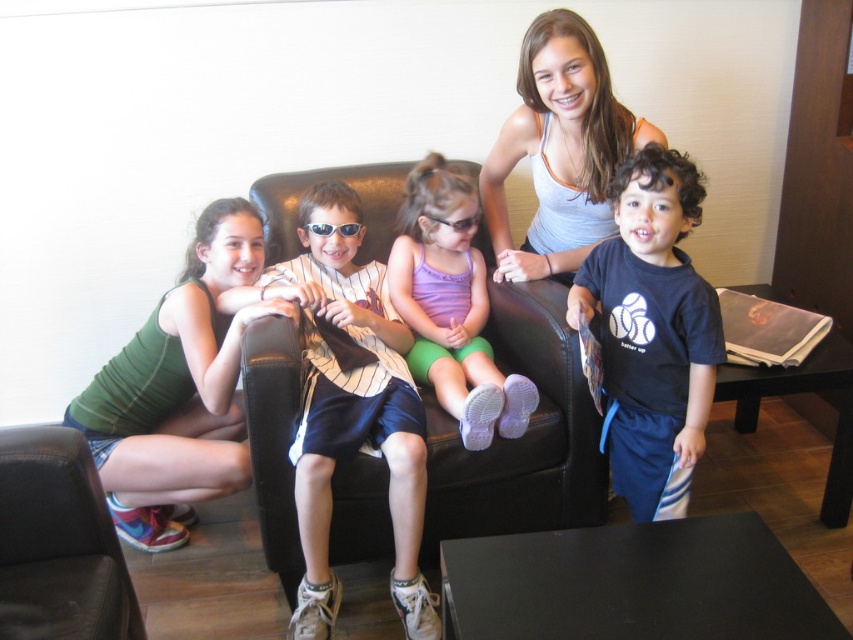
Question: Which object appears closest to the camera in this image?

Choices:
 (A) black plastic sunglasses at center
 (B) white tank top at upper center

Answer: (B)

Question: Is green fabric tank top at lower left positioned behind white tank top at upper center?

Choices:
 (A) yes
 (B) no

Answer: (B)

Question: From the image, what is the correct spatial relationship of white striped shirt at center in relation to purple fabric shorts at center?

Choices:
 (A) left
 (B) right

Answer: (A)

Question: Which object is closer to the camera taking this photo?

Choices:
 (A) black matte shirt at center
 (B) white tank top at upper center

Answer: (A)

Question: Which object is positioned farthest from the black plastic sunglasses at center?

Choices:
 (A) white striped shirt at center
 (B) green fabric tank top at lower left
 (C) white tank top at upper center

Answer: (C)

Question: Can you confirm if purple fabric shorts at center is thinner than black plastic sunglasses at center?

Choices:
 (A) yes
 (B) no

Answer: (B)